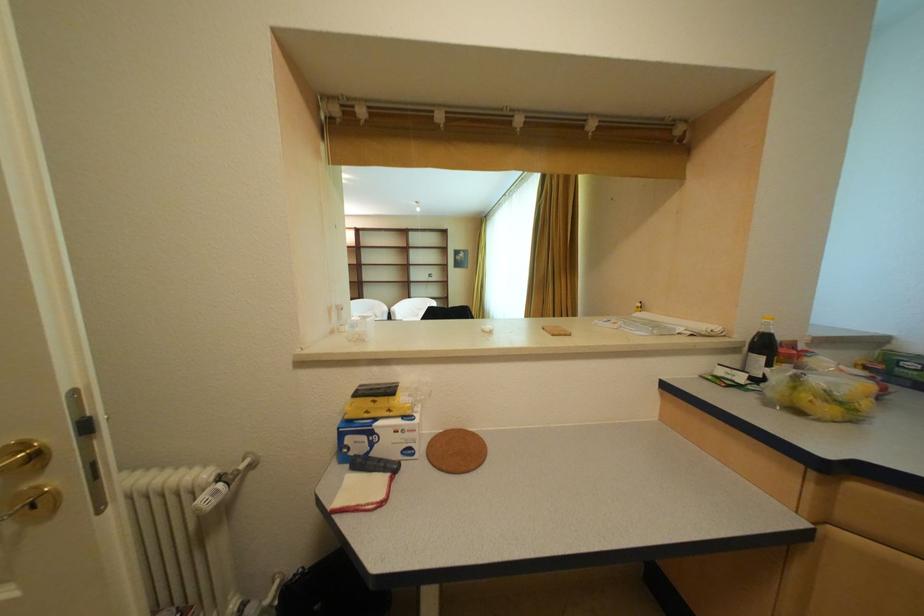
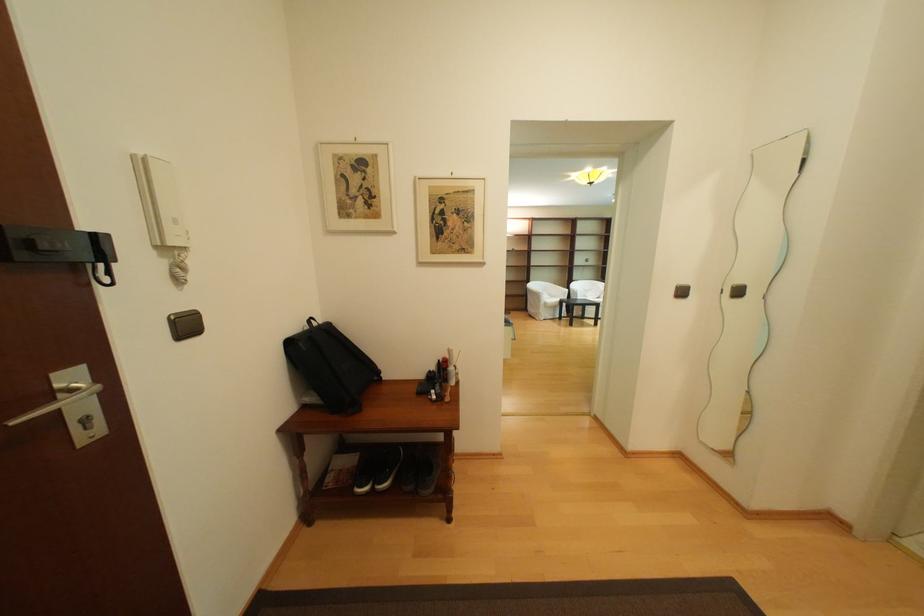
Question: The images are taken continuously from a first-person perspective. In which direction are you moving?

Choices:
 (A) Left
 (B) Right
 (C) Forward
 (D) Backward

Answer: (A)